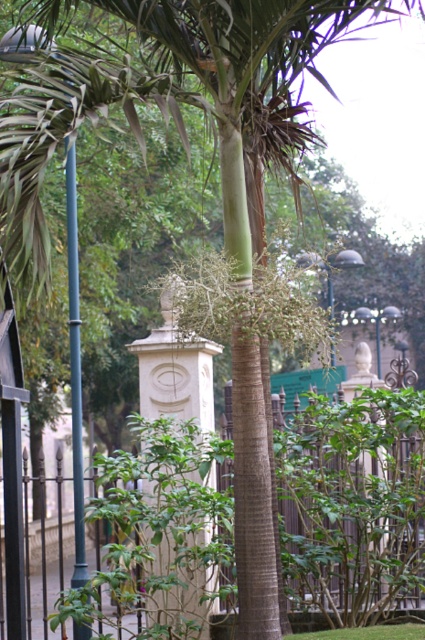
Question: Can you confirm if black metal fence at center is smaller than metallic pole at left?

Choices:
 (A) no
 (B) yes

Answer: (A)

Question: From the image, what is the correct spatial relationship of black metal fence at center in relation to metallic pole at left?

Choices:
 (A) left
 (B) right

Answer: (B)

Question: Does black metal fence at center come behind metallic pole at left?

Choices:
 (A) yes
 (B) no

Answer: (A)

Question: Which object appears farthest from the camera in this image?

Choices:
 (A) metallic pole at left
 (B) black metal fence at center

Answer: (B)

Question: Which point appears closest to the camera in this image?

Choices:
 (A) (308, 435)
 (B) (81, 525)

Answer: (B)

Question: Among these points, which one is farthest from the camera?

Choices:
 (A) (104, 484)
 (B) (70, 259)

Answer: (A)